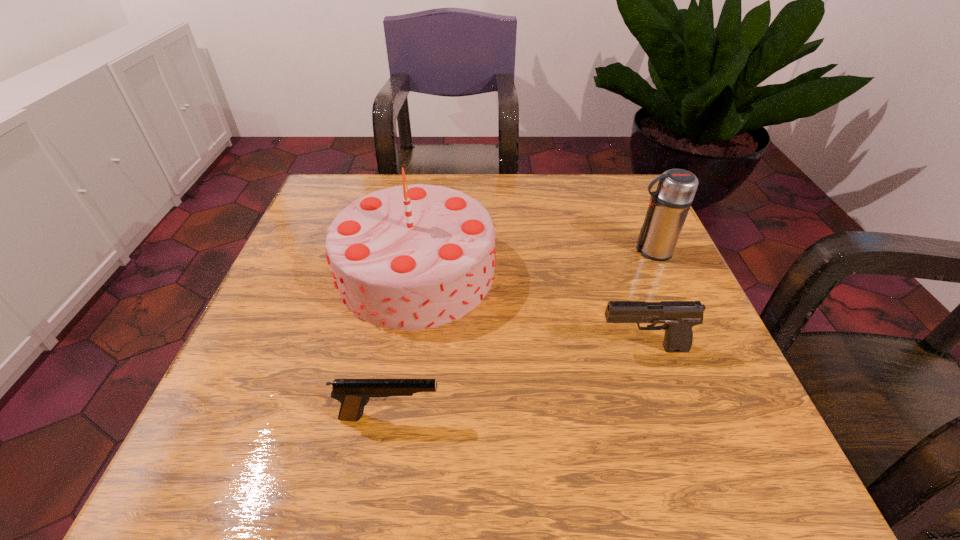
Locate an element on the screen. The width and height of the screenshot is (960, 540). the tallest object is located at coordinates (410, 257).

Identify the location of thermos bottle. The image size is (960, 540). (669, 205).

What are the coordinates of `the third tallest object` in the screenshot? It's located at (x=679, y=317).

Image resolution: width=960 pixels, height=540 pixels. I want to click on the right pistol, so click(679, 317).

Locate an element on the screen. the shortest object is located at coordinates (353, 394).

Where is `the shorter pistol`? This screenshot has height=540, width=960. the shorter pistol is located at coordinates (353, 394).

Where is `vacant region located 0.160m on the front of the tallest object`? The image size is (960, 540). vacant region located 0.160m on the front of the tallest object is located at coordinates (395, 411).

Where is `free location located with a handle on the side of the second tallest object`? This screenshot has height=540, width=960. free location located with a handle on the side of the second tallest object is located at coordinates (513, 251).

Find the location of `vacant space located 0.360m with a handle on the side of the second tallest object`. vacant space located 0.360m with a handle on the side of the second tallest object is located at coordinates (468, 251).

The width and height of the screenshot is (960, 540). Identify the location of free location located 0.360m with a handle on the side of the second tallest object. (468, 251).